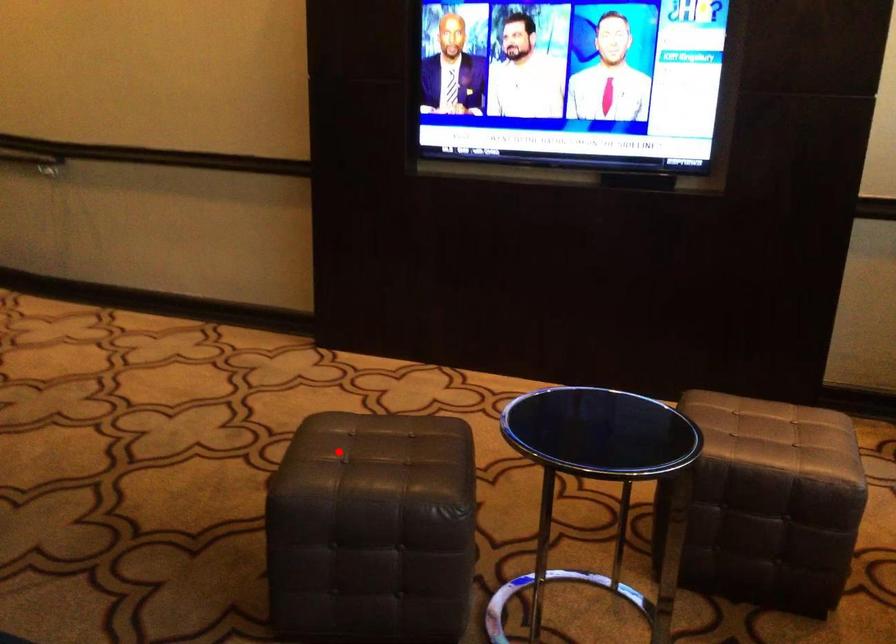
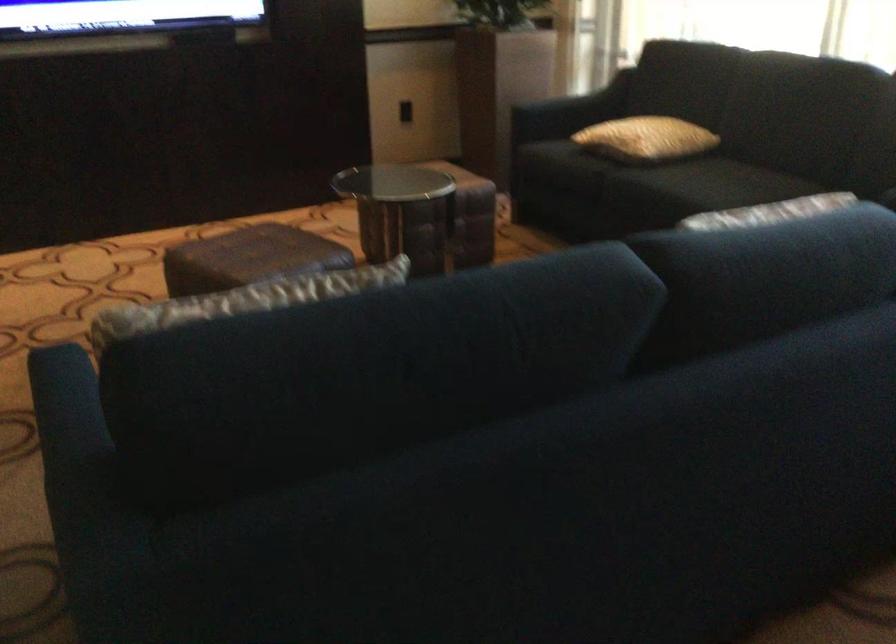
Find the pixel in the second image that matches the highlighted location in the first image.

(248, 258)